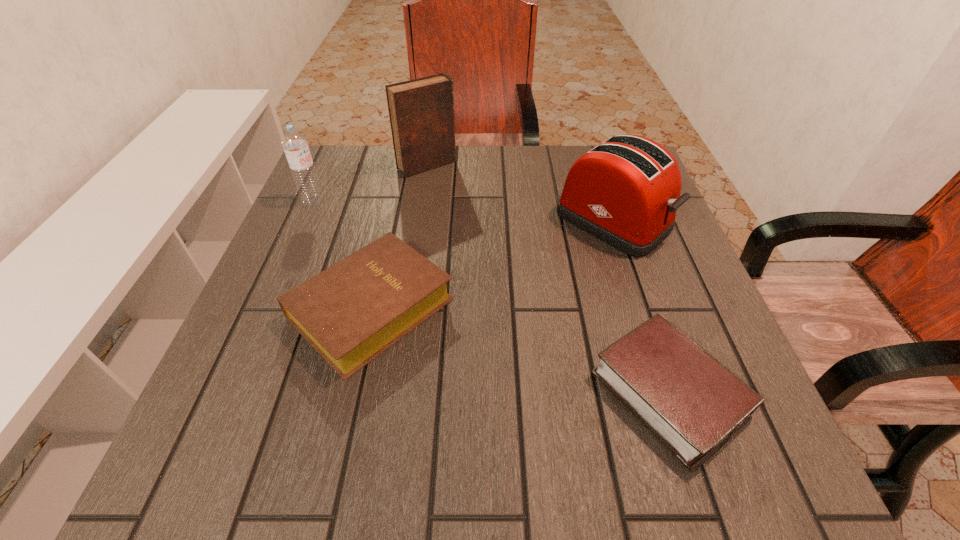
Where is `water bottle that is at the far edge`? This screenshot has width=960, height=540. water bottle that is at the far edge is located at coordinates (295, 145).

You are a GUI agent. You are given a task and a screenshot of the screen. Output one action in this format:
    pyautogui.click(x=<x>, y=<y>)
    Task: Click on the toaster that is positioned at the far edge
    The width and height of the screenshot is (960, 540).
    Given the screenshot: What is the action you would take?
    pyautogui.click(x=626, y=191)

Locate an element on the screen. object that is at the near edge is located at coordinates (692, 403).

Find the location of a particular element. water bottle positioned at the left edge is located at coordinates (295, 145).

The image size is (960, 540). In order to click on Bible that is at the left edge in this screenshot , I will do `click(350, 313)`.

Locate an element on the screen. The image size is (960, 540). toaster present at the right edge is located at coordinates (626, 191).

Identify the location of Bible that is at the right edge. Image resolution: width=960 pixels, height=540 pixels. (692, 403).

You are a GUI agent. You are given a task and a screenshot of the screen. Output one action in this format:
    pyautogui.click(x=<x>, y=<y>)
    Task: Click on the object that is at the far left corner
    The image size is (960, 540).
    Given the screenshot: What is the action you would take?
    pyautogui.click(x=295, y=145)

The height and width of the screenshot is (540, 960). What are the coordinates of `object that is at the far right corner` in the screenshot? It's located at (626, 191).

In order to click on object located at the near right corner in this screenshot , I will do `click(692, 403)`.